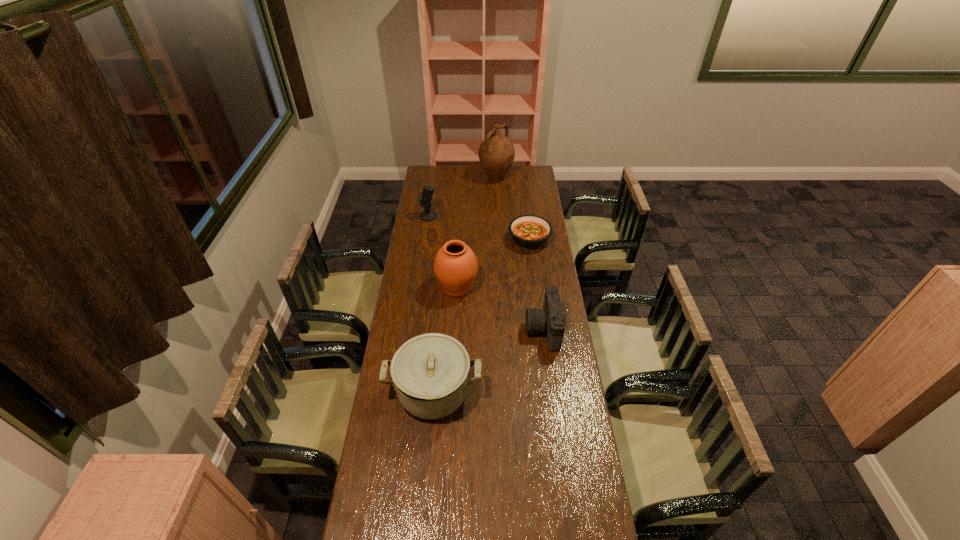
Where is `the tallest object`? the tallest object is located at coordinates 496,153.

The image size is (960, 540). I want to click on the farthest object, so click(x=496, y=153).

The image size is (960, 540). In order to click on the fifth shortest object in this screenshot , I will do `click(455, 266)`.

Identify the location of the fourth farthest object. (455, 266).

Locate an element on the screen. the fifth nearest object is located at coordinates (428, 215).

Identify the location of the nearest object. This screenshot has height=540, width=960. (430, 373).

This screenshot has width=960, height=540. In order to click on the fifth farthest object in this screenshot , I will do `click(550, 319)`.

Locate an element on the screen. the fifth tallest object is located at coordinates (550, 319).

The height and width of the screenshot is (540, 960). In order to click on the third farthest object in this screenshot , I will do `click(528, 231)`.

Where is `stew`? This screenshot has height=540, width=960. stew is located at coordinates (528, 231).